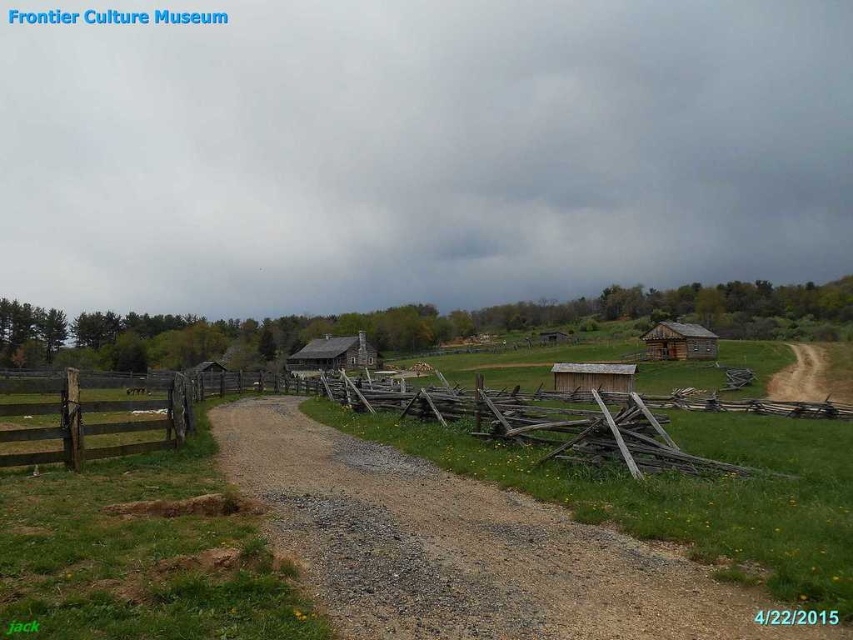
Which is behind, point (509, 576) or point (606, 364)?

The point (606, 364) is behind.

Is brown gravel road at center to the right of wooden hut at center from the viewer's perspective?

Incorrect, brown gravel road at center is not on the right side of wooden hut at center.

This screenshot has width=853, height=640. In order to click on brown gravel road at center in this screenshot , I will do `click(460, 547)`.

Is wooden cabin at center positioned in front of wooden hut at center?

That is False.

Does point (321, 344) come in front of point (634, 372)?

No, (321, 344) is behind (634, 372).

Locate an element on the screen. wooden cabin at center is located at coordinates (334, 353).

Does wooden cabin at center have a larger size compared to rustic wooden hut at center-right?

Correct, wooden cabin at center is larger in size than rustic wooden hut at center-right.

Is wooden cabin at center further to the viewer compared to rustic wooden hut at center-right?

Yes, it is behind rustic wooden hut at center-right.

Is point (341, 362) positioned after point (686, 353)?

Yes, point (341, 362) is behind point (686, 353).

This screenshot has width=853, height=640. What are the coordinates of `wooden cabin at center` in the screenshot? It's located at (334, 353).